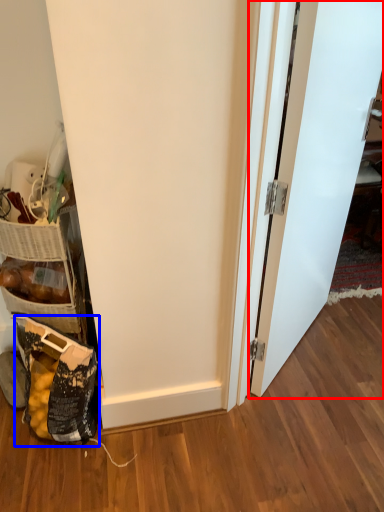
Question: Which object is closer to the camera taking this photo, door (highlighted by a red box) or material (highlighted by a blue box)?

Choices:
 (A) door
 (B) material

Answer: (A)